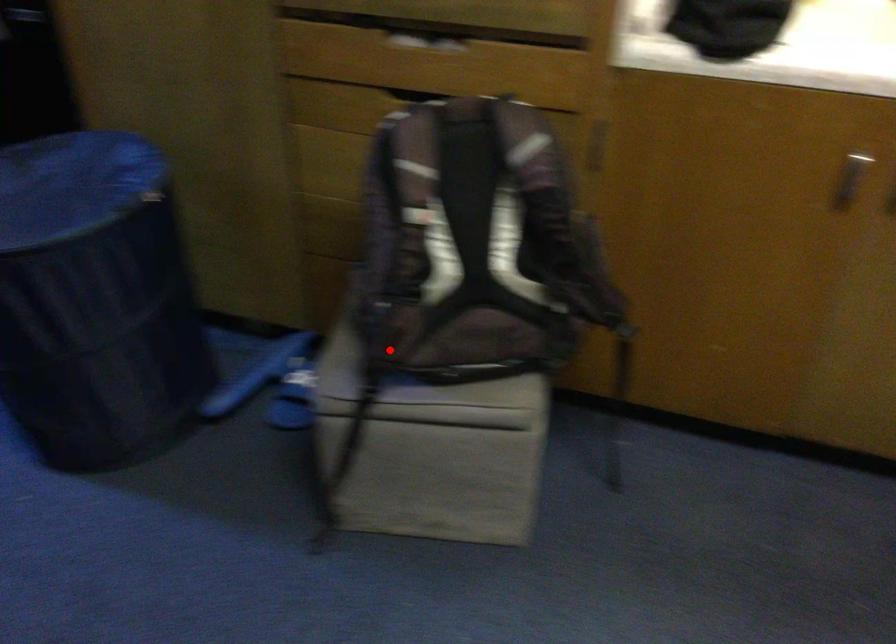
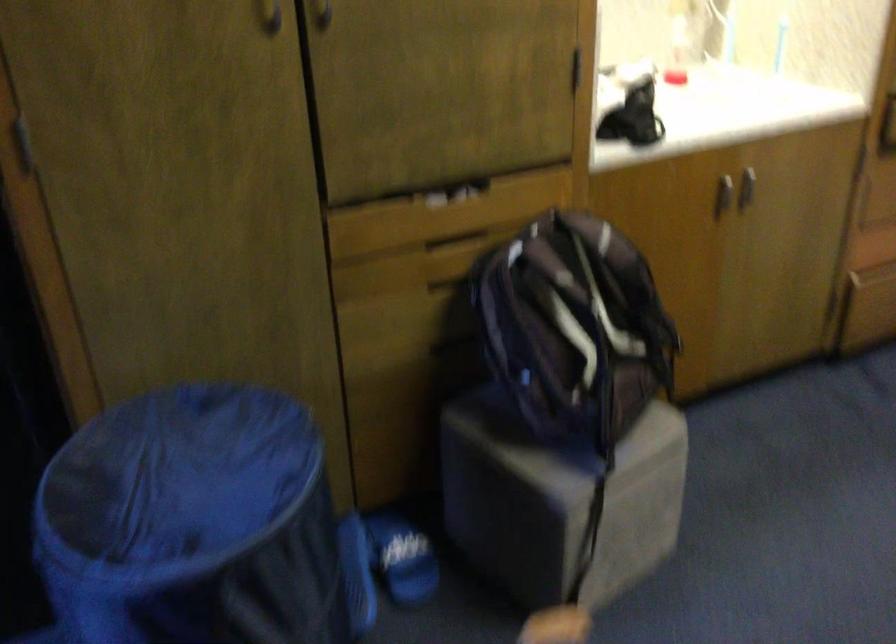
Question: I am providing you with two images of the same scene from different viewpoints. A red point is shown in image1. For the corresponding object point in image2, is it positioned nearer or farther from the camera?

Choices:
 (A) Nearer
 (B) Farther

Answer: (B)